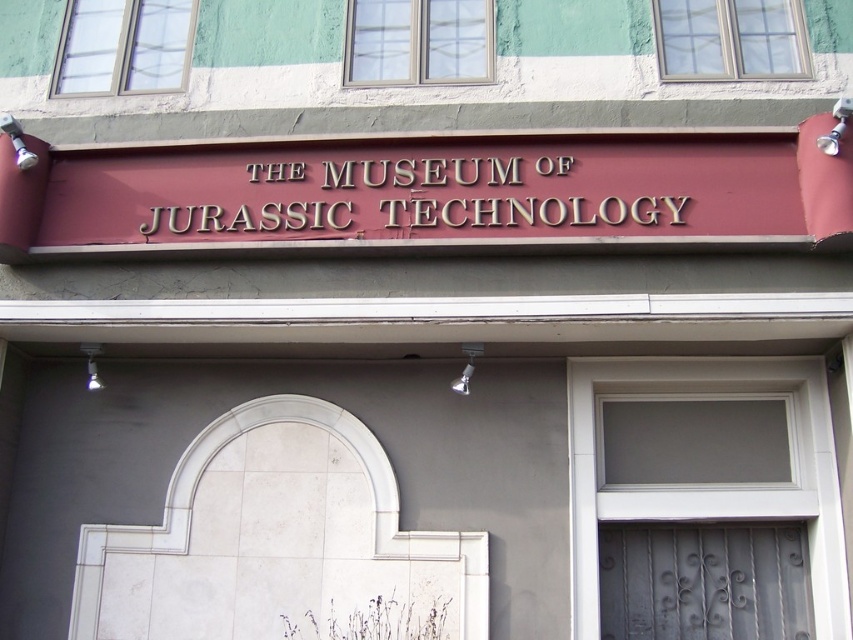
You are standing in front of The Museum of Jurassic Technology. You see a point at coordinate [703,483]. What does this point represent?

The point at coordinate [703,483] represents the white glass door at center.

You are a delivery person with a package that requires a 2 meter clearance to pass through the entrance. Given that the white glass door at center and the matte gold sign at center are positioned in the scene, can you determine if there is enough space to maneuver the package through the entrance without touching either the door or the sign?

The white glass door at center is 1.88 meters from the matte gold sign at center. Since the required clearance is 2 meters and the distance between them is less than that, the package cannot pass through the entrance without touching either the door or the sign.